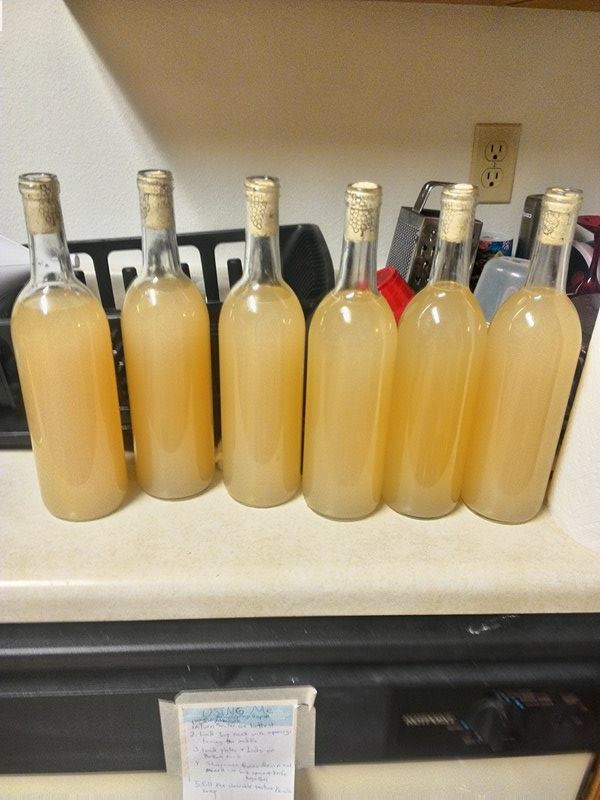
The image size is (600, 800). Identify the location of white masking tape. (246, 696), (173, 737), (299, 736).